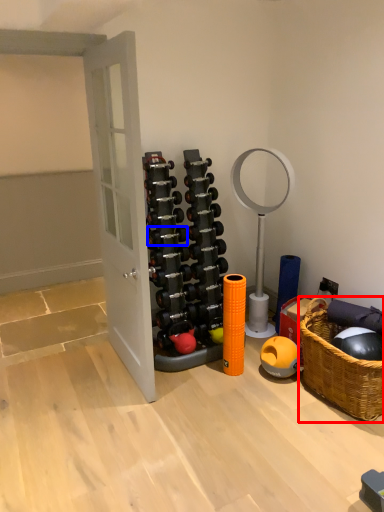
Question: Which of the following is the closest to the observer, picnic basket (highlighted by a red box) or dumbbell (highlighted by a blue box)?

Choices:
 (A) picnic basket
 (B) dumbbell

Answer: (A)